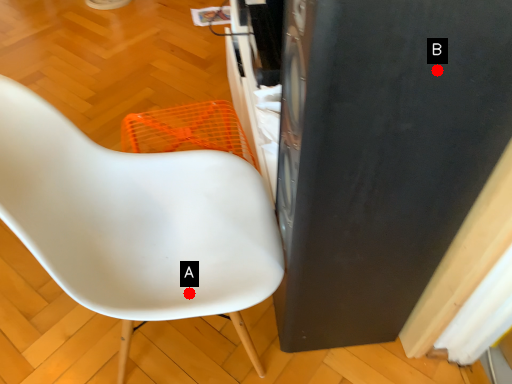
Question: Two points are circled on the image, labeled by A and B beside each circle. Which of the following is the closest to the observer?

Choices:
 (A) A is closer
 (B) B is closer

Answer: (B)